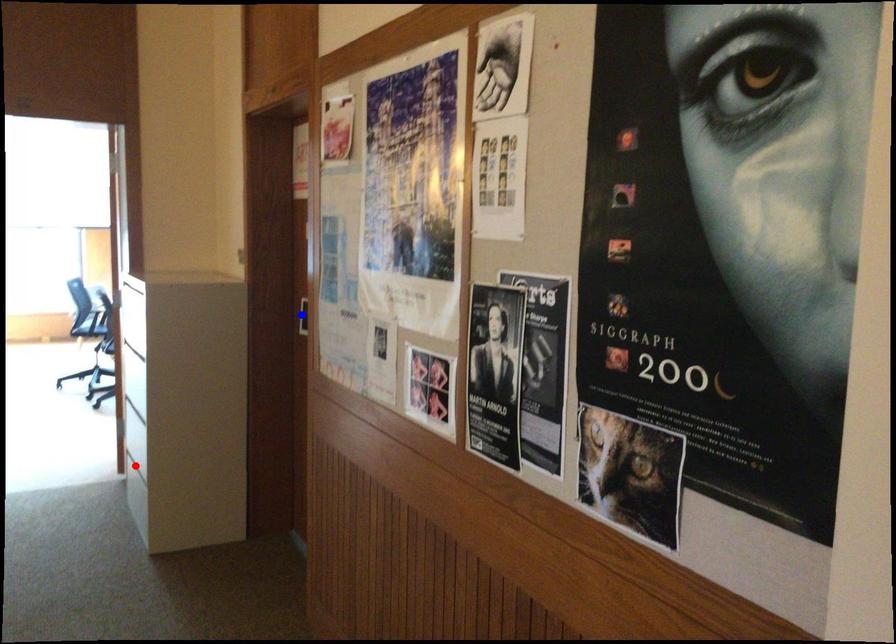
Question: In the image, two points are highlighted. Which point is nearer to the camera? Reply with the corresponding letter.

Choices:
 (A) blue point
 (B) red point

Answer: (A)